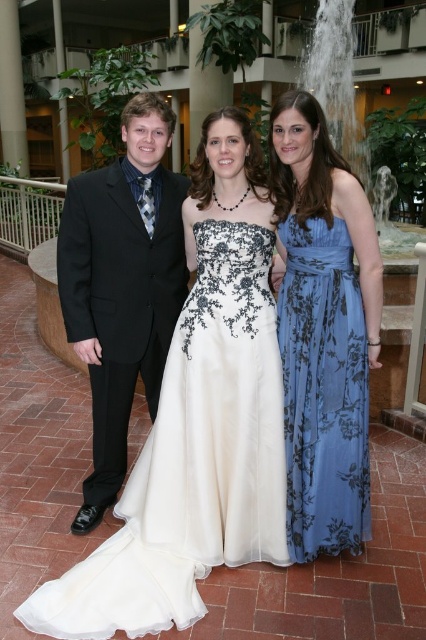
Question: Which of the following is the closest to the observer?

Choices:
 (A) blue floral dress at center
 (B) black satin suit at center
 (C) ivory satin dress at center

Answer: (C)

Question: Can you confirm if ivory satin dress at center is smaller than blue floral dress at center?

Choices:
 (A) no
 (B) yes

Answer: (A)

Question: Considering the relative positions of ivory satin dress at center and black satin suit at center in the image provided, where is ivory satin dress at center located with respect to black satin suit at center?

Choices:
 (A) above
 (B) below

Answer: (B)

Question: Observing the image, what is the correct spatial positioning of ivory satin dress at center in reference to blue floral dress at center?

Choices:
 (A) left
 (B) right

Answer: (A)

Question: Which point is farther to the camera?

Choices:
 (A) black satin suit at center
 (B) blue floral dress at center

Answer: (A)

Question: Which object appears closest to the camera in this image?

Choices:
 (A) ivory satin dress at center
 (B) blue floral dress at center
 (C) black satin suit at center

Answer: (A)